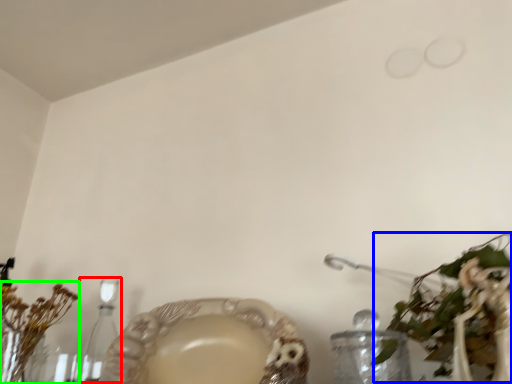
Question: Considering the real-world distances, which object is closest to candle holder (highlighted by a red box)? floral arrangement (highlighted by a blue box) or floral arrangement (highlighted by a green box).

Choices:
 (A) floral arrangement
 (B) floral arrangement

Answer: (B)